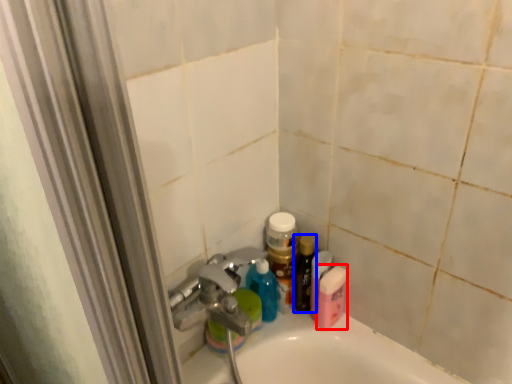
Question: Which of the following is the farthest to the observer, mouthwash (highlighted by a red box) or toiletry (highlighted by a blue box)?

Choices:
 (A) mouthwash
 (B) toiletry

Answer: (B)